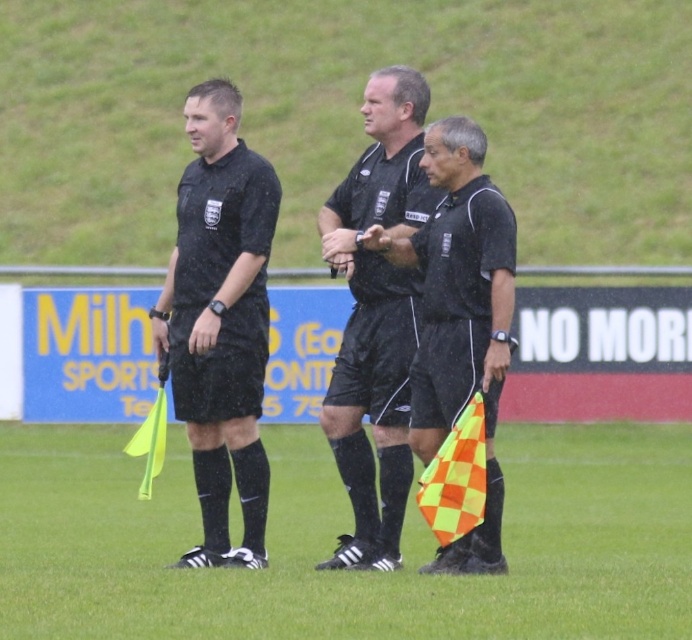
From the picture: Who is lower down, matte black shorts at left or matte black flag at center?

matte black flag at center is below.

Looking at this image, who is positioned more to the left, matte black shorts at left or matte black flag at center?

matte black shorts at left is more to the left.

This screenshot has height=640, width=692. What do you see at coordinates (219, 321) in the screenshot? I see `matte black shorts at left` at bounding box center [219, 321].

I want to click on matte black shorts at left, so click(219, 321).

Is point (72, 628) in front of point (372, 403)?

That is True.

Between point (255, 580) and point (363, 566), which one is positioned behind?

The point (363, 566) is more distant.

At what (x,y) coordinates should I click in order to perform the action: click on orange checkered flag at lower center. Please return your answer as a coordinate pair (x, y). The height and width of the screenshot is (640, 692). Looking at the image, I should click on (334, 541).

Between orange checkered flag at lower center and matte black flag at center, which one appears on the right side from the viewer's perspective?

matte black flag at center

Who is lower down, orange checkered flag at lower center or matte black flag at center?

orange checkered flag at lower center is lower down.

The height and width of the screenshot is (640, 692). I want to click on orange checkered flag at lower center, so tap(334, 541).

You are a GUI agent. You are given a task and a screenshot of the screen. Output one action in this format:
    pyautogui.click(x=<x>, y=<y>)
    Task: Click on the orange checkered flag at lower center
    This screenshot has height=640, width=692.
    Given the screenshot: What is the action you would take?
    click(x=334, y=541)